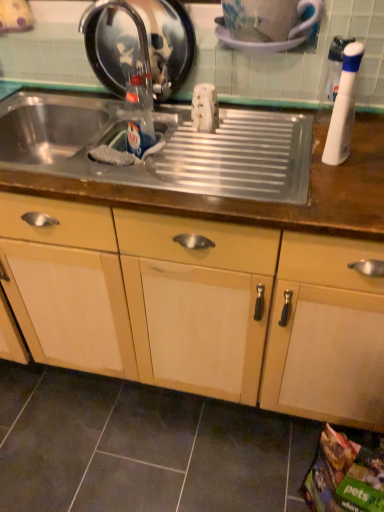
Measure the distance between metallic stainless steel tray at center and camera.

metallic stainless steel tray at center is 33.15 inches away from camera.

Where is `glossy ceramic mug at upper center`? The height and width of the screenshot is (512, 384). glossy ceramic mug at upper center is located at coordinates (275, 41).

What do you see at coordinates (275, 41) in the screenshot? I see `glossy ceramic mug at upper center` at bounding box center [275, 41].

This screenshot has height=512, width=384. What do you see at coordinates (343, 106) in the screenshot?
I see `white plastic bottle at right, the 1th bottle positioned from the right` at bounding box center [343, 106].

Find the location of a particular element. clear glass bottle at center, arranged as the first bottle when viewed from the left is located at coordinates (139, 115).

Is glossy ceramic mug at upper center not within satin nickel faucet at upper left?

Indeed, glossy ceramic mug at upper center is completely outside satin nickel faucet at upper left.

How far apart are glossy ceramic mug at upper center and satin nickel faucet at upper left?

glossy ceramic mug at upper center is 13.85 inches away from satin nickel faucet at upper left.

Based on their positions, is glossy ceramic mug at upper center located to the left or right of satin nickel faucet at upper left?

Clearly, glossy ceramic mug at upper center is on the right of satin nickel faucet at upper left in the image.

Is glossy ceramic mug at upper center facing away from satin nickel faucet at upper left?

glossy ceramic mug at upper center does not have its back to satin nickel faucet at upper left.

From a real-world perspective, relative to matte wood cabinet at center, is metallic stainless steel tray at center vertically above or below?

In terms of real-world spatial position, metallic stainless steel tray at center is above matte wood cabinet at center.

Which of these two, metallic stainless steel tray at center or matte wood cabinet at center, is smaller?

With smaller size is metallic stainless steel tray at center.

Is matte wood cabinet at center surrounded by metallic stainless steel tray at center?

Definitely not — matte wood cabinet at center is not inside metallic stainless steel tray at center.

Is metallic stainless steel tray at center turned away from matte wood cabinet at center?

Correct, metallic stainless steel tray at center is looking away from matte wood cabinet at center.

Based on the photo, from a real-world perspective, is matte wood cabinet at center located beneath metallic stainless steel tray at center?

Yes, from a real-world perspective, matte wood cabinet at center is under metallic stainless steel tray at center.

In the scene shown: Considering the relative sizes of matte wood cabinet at center and metallic stainless steel tray at center in the image provided, is matte wood cabinet at center thinner than metallic stainless steel tray at center?

In fact, matte wood cabinet at center might be wider than metallic stainless steel tray at center.

Could you tell me if matte wood cabinet at center is facing metallic stainless steel tray at center?

No.

Identify the location of countertop behind the matte wood cabinet at center. (198, 167).

Is metallic stainless steel tray at center smaller than clear glass bottle at center, arranged as the first bottle when viewed from the left?

No.

Is metallic stainless steel tray at center positioned far away from clear glass bottle at center, the 1th bottle viewed from the back?

metallic stainless steel tray at center is near clear glass bottle at center, the 1th bottle viewed from the back, not far away.

Which is behind, point (262, 166) or point (151, 133)?

The point (151, 133) is farther.

Looking at this image, considering the relative positions of metallic stainless steel tray at center and white plastic bottle at right, placed as the 2th bottle when sorted from left to right, in the image provided, is metallic stainless steel tray at center to the left of white plastic bottle at right, placed as the 2th bottle when sorted from left to right, from the viewer's perspective?

Yes.

In terms of height, does metallic stainless steel tray at center look taller or shorter compared to white plastic bottle at right, which appears as the 2th bottle when viewed from the back?

In the image, metallic stainless steel tray at center appears to be shorter than white plastic bottle at right, which appears as the 2th bottle when viewed from the back.

Consider the image. Is white plastic bottle at right, placed as the 2th bottle when sorted from left to right, at the back of metallic stainless steel tray at center?

No, metallic stainless steel tray at center's orientation is not away from white plastic bottle at right, placed as the 2th bottle when sorted from left to right.

Which object is wider, satin nickel faucet at upper left or white plastic bottle at right, which ranks as the 1th bottle in front-to-back order?

Wider between the two is satin nickel faucet at upper left.

Which is correct: satin nickel faucet at upper left is inside white plastic bottle at right, placed as the 2th bottle when sorted from left to right, or outside of it?

The correct answer is: outside.

Locate an element on the screen. The width and height of the screenshot is (384, 512). bottle lying in front of the satin nickel faucet at upper left is located at coordinates (343, 106).

Is satin nickel faucet at upper left oriented away from white plastic bottle at right, which appears as the 2th bottle when viewed from the back?

satin nickel faucet at upper left is not turned away from white plastic bottle at right, which appears as the 2th bottle when viewed from the back.

Is clear glass bottle at center, the 1th bottle viewed from the back, inside the boundaries of metallic stainless steel tray at center, or outside?

clear glass bottle at center, the 1th bottle viewed from the back, is inside metallic stainless steel tray at center.

Considering the positions of point (146, 141) and point (357, 139), is point (146, 141) closer or farther from the camera than point (357, 139)?

Point (146, 141) appears to be farther away from the viewer than point (357, 139).

Is clear glass bottle at center, which ranks as the 2th bottle in right-to-left order, turned away from metallic stainless steel tray at center?

No, clear glass bottle at center, which ranks as the 2th bottle in right-to-left order, is not facing the opposite direction of metallic stainless steel tray at center.

In terms of width, does clear glass bottle at center, which ranks as the 2th bottle in right-to-left order, look wider or thinner when compared to metallic stainless steel tray at center?

In the image, clear glass bottle at center, which ranks as the 2th bottle in right-to-left order, appears to be more narrow than metallic stainless steel tray at center.

Identify the location of appliance that appears on the right of satin nickel faucet at upper left. (275, 41).

Identify the location of countertop that appears on the left of matte wood cabinet at center. (198, 167).

Which object lies nearer to the anchor point clear glass bottle at center, which ranks as the 2th bottle in right-to-left order, satin nickel faucet at upper left or white plastic bottle at right, the 1th bottle positioned from the right?

satin nickel faucet at upper left.

Based on their spatial positions, is metallic stainless steel tray at center or glossy ceramic mug at upper center further from satin nickel faucet at upper left?

Based on the image, glossy ceramic mug at upper center appears to be further to satin nickel faucet at upper left.

Estimate the real-world distances between objects in this image. Which object is further from white plastic bottle at right, which ranks as the 1th bottle in front-to-back order, satin nickel faucet at upper left or clear glass bottle at center, which ranks as the 2th bottle in right-to-left order?

Among the two, satin nickel faucet at upper left is located further to white plastic bottle at right, which ranks as the 1th bottle in front-to-back order.

Looking at the image, which one is located closer to metallic stainless steel tray at center, satin nickel faucet at upper left or glossy ceramic mug at upper center?

satin nickel faucet at upper left is positioned closer to the anchor metallic stainless steel tray at center.

When comparing their distances from matte wood cabinet at center, does metallic stainless steel tray at center or white plastic bottle at right, placed as the 2th bottle when sorted from left to right, seem closer?

The object closer to matte wood cabinet at center is metallic stainless steel tray at center.

Considering their positions, is satin nickel faucet at upper left positioned closer to glossy ceramic mug at upper center than matte wood cabinet at center?

satin nickel faucet at upper left.

Which object lies further to the anchor point white plastic bottle at right, which appears as the 2th bottle when viewed from the back, glossy ceramic mug at upper center or clear glass bottle at center, which ranks as the 2th bottle in right-to-left order?

clear glass bottle at center, which ranks as the 2th bottle in right-to-left order.

Looking at the image, which one is located closer to clear glass bottle at center, which ranks as the 2th bottle in right-to-left order, white plastic bottle at right, the 1th bottle positioned from the right, or glossy ceramic mug at upper center?

glossy ceramic mug at upper center is closer to clear glass bottle at center, which ranks as the 2th bottle in right-to-left order.

Find the location of `bottle between metallic stainless steel tray at center and glossy ceramic mug at upper center`. bottle between metallic stainless steel tray at center and glossy ceramic mug at upper center is located at coordinates (139, 115).

You are a GUI agent. You are given a task and a screenshot of the screen. Output one action in this format:
    pyautogui.click(x=<x>, y=<y>)
    Task: Click on the countertop between glossy ceramic mug at upper center and matte wood cabinet at center from top to bottom
    This screenshot has width=384, height=512.
    Given the screenshot: What is the action you would take?
    pyautogui.click(x=198, y=167)

At what (x,y) coordinates should I click in order to perform the action: click on appliance between satin nickel faucet at upper left and white plastic bottle at right, which appears as the 2th bottle when viewed from the back. Please return your answer as a coordinate pair (x, y). This screenshot has width=384, height=512. Looking at the image, I should click on (275, 41).

The width and height of the screenshot is (384, 512). I want to click on cabinetry situated between metallic stainless steel tray at center and white plastic bottle at right, the 1th bottle positioned from the right, from left to right, so click(199, 306).